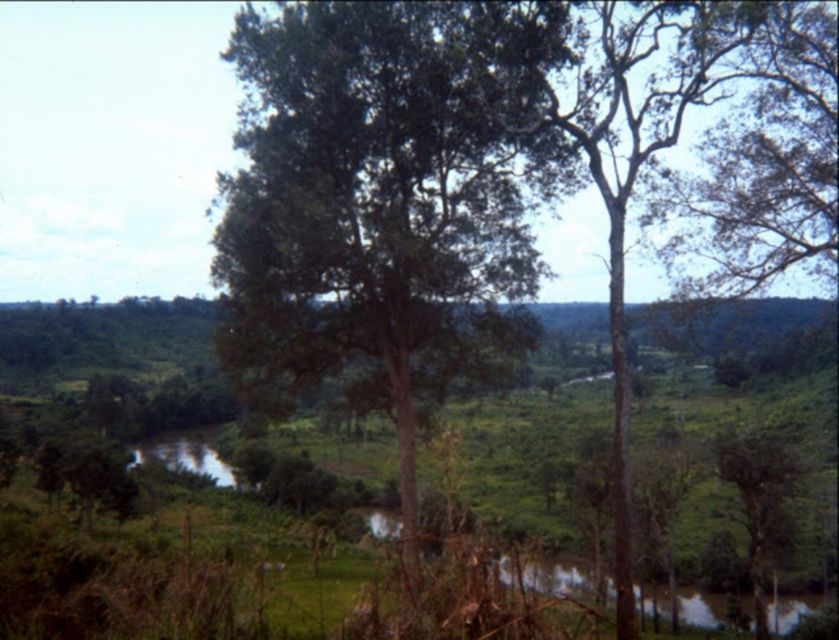
Question: Does green rough bark tree at center come behind green matte tree at lower right?

Choices:
 (A) no
 (B) yes

Answer: (A)

Question: Which point is closer to the camera?

Choices:
 (A) green rough bark tree at center
 (B) green matte tree at lower right

Answer: (A)

Question: Which point is closer to the camera taking this photo?

Choices:
 (A) (752, 440)
 (B) (491, 221)

Answer: (B)

Question: Which object is the farthest from the green rough bark tree at center?

Choices:
 (A) green leafy tree at center
 (B) green matte tree at lower right

Answer: (B)

Question: Is green rough bark tree at center smaller than green matte tree at lower right?

Choices:
 (A) yes
 (B) no

Answer: (B)

Question: Can you confirm if green rough bark tree at center is positioned below green matte tree at lower right?

Choices:
 (A) no
 (B) yes

Answer: (A)